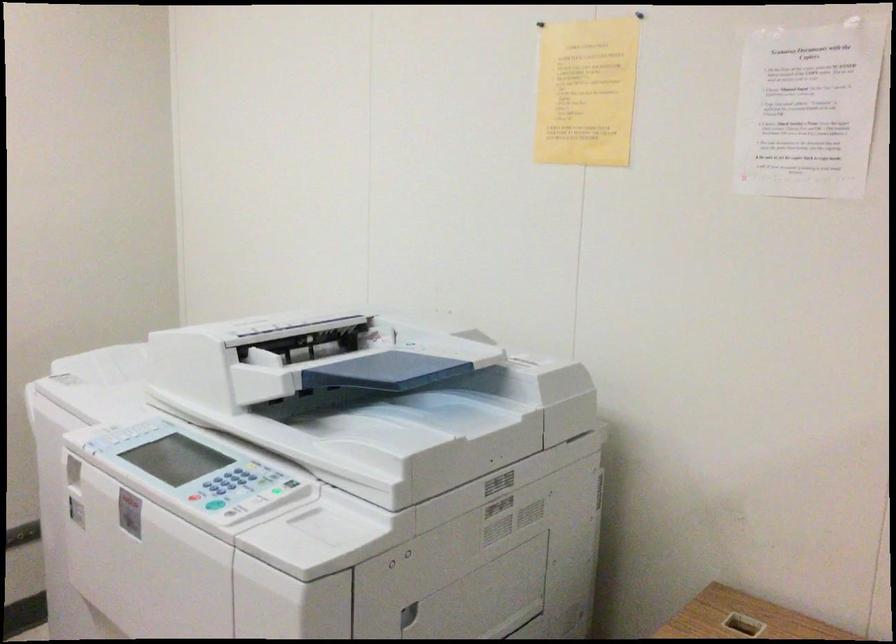
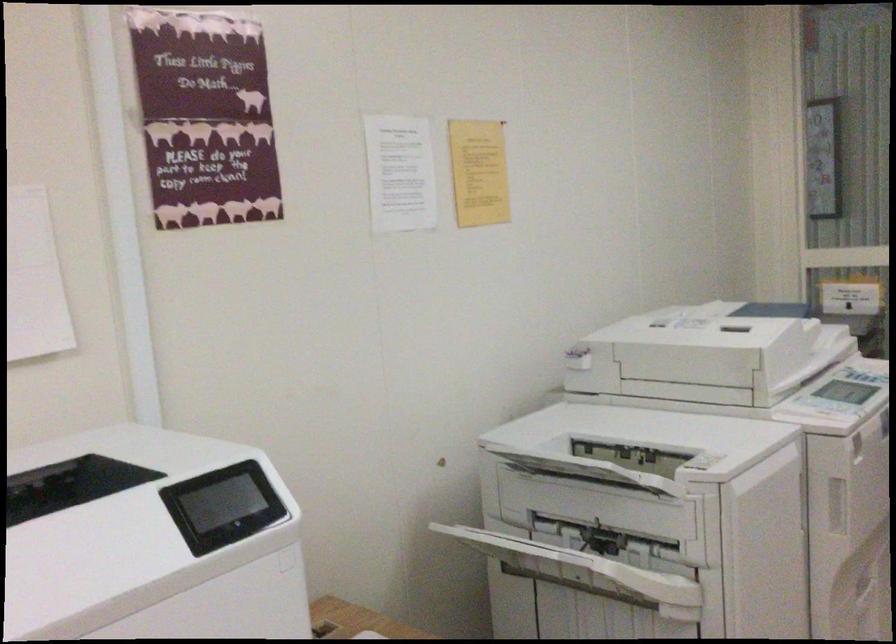
Question: Based on the continuous images, in which direction is the camera rotating? Reply with the corresponding letter.

Choices:
 (A) Left
 (B) Right
 (C) Up
 (D) Down

Answer: (B)